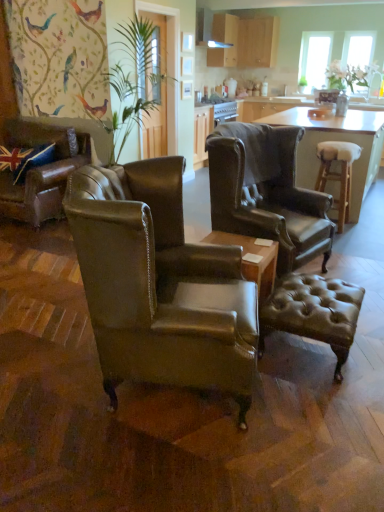
Question: Should I look upward or downward to see leather wingback chair at left, which is the 3th chair from right to left?

Choices:
 (A) down
 (B) up

Answer: (B)

Question: Does leather wingback chair at center, marked as the 1th chair in a right-to-left arrangement, lie behind translucent glass window at upper right, the second window screen from the left?

Choices:
 (A) no
 (B) yes

Answer: (A)

Question: Would you say leather wingback chair at center, the 2th chair positioned from the back, contains translucent glass window at upper right, the second window screen from the left?

Choices:
 (A) yes
 (B) no

Answer: (B)

Question: Is leather wingback chair at center, which is the second chair in front-to-back order, not close to translucent glass window at upper right, positioned as the first window screen in right-to-left order?

Choices:
 (A) yes
 (B) no

Answer: (A)

Question: Is leather wingback chair at center, which is the second chair in front-to-back order, looking in the opposite direction of translucent glass window at upper right, the second window screen from the left?

Choices:
 (A) no
 (B) yes

Answer: (A)

Question: Is leather wingback chair at center, marked as the 1th chair in a right-to-left arrangement, completely or partially outside of translucent glass window at upper right, the second window screen from the left?

Choices:
 (A) no
 (B) yes

Answer: (B)

Question: Is leather wingback chair at center, marked as the 1th chair in a right-to-left arrangement, shorter than translucent glass window at upper right, positioned as the first window screen in right-to-left order?

Choices:
 (A) no
 (B) yes

Answer: (A)

Question: Does light brown wooden stool at right come in front of matte wood exhaust hood at upper center?

Choices:
 (A) no
 (B) yes

Answer: (B)

Question: Is light brown wooden stool at right outside of matte wood exhaust hood at upper center?

Choices:
 (A) yes
 (B) no

Answer: (A)

Question: Considering the relative sizes of light brown wooden stool at right and matte wood exhaust hood at upper center in the image provided, is light brown wooden stool at right wider than matte wood exhaust hood at upper center?

Choices:
 (A) no
 (B) yes

Answer: (A)

Question: From the image's perspective, is light brown wooden stool at right over matte wood exhaust hood at upper center?

Choices:
 (A) no
 (B) yes

Answer: (A)

Question: From the image's perspective, is light brown wooden stool at right below matte wood exhaust hood at upper center?

Choices:
 (A) yes
 (B) no

Answer: (A)

Question: Is light brown wooden stool at right further to the viewer compared to matte wood exhaust hood at upper center?

Choices:
 (A) no
 (B) yes

Answer: (A)

Question: Does matte wood cabinets at upper center, arranged as the 1th cabinetry when viewed from the left, appear on the left side of translucent glass window at upper right, positioned as the first window screen in right-to-left order?

Choices:
 (A) no
 (B) yes

Answer: (B)